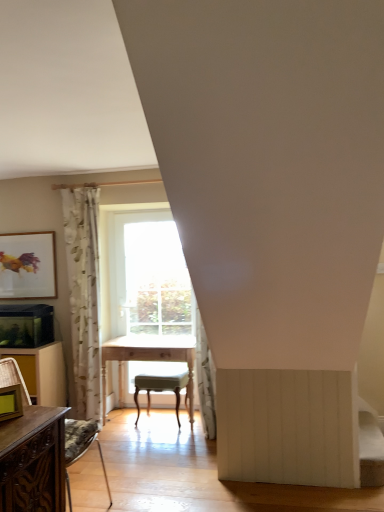
Question: From a real-world perspective, is brown wood dresser at lower left positioned over matte gold picture frame at lower left, placed as the second picture frame when sorted from back to front, based on gravity?

Choices:
 (A) no
 (B) yes

Answer: (A)

Question: Is brown wood dresser at lower left facing towards matte gold picture frame at lower left, which is counted as the second picture frame, starting from the left?

Choices:
 (A) no
 (B) yes

Answer: (A)

Question: Can you confirm if brown wood dresser at lower left is positioned to the left of matte gold picture frame at lower left, which is counted as the 1th picture frame, starting from the bottom?

Choices:
 (A) yes
 (B) no

Answer: (A)

Question: Can you confirm if brown wood dresser at lower left is smaller than matte gold picture frame at lower left, which is counted as the 1th picture frame, starting from the bottom?

Choices:
 (A) yes
 (B) no

Answer: (B)

Question: Considering the relative positions of brown wood dresser at lower left and matte gold picture frame at lower left, marked as the 1th picture frame in a front-to-back arrangement, in the image provided, is brown wood dresser at lower left in front of matte gold picture frame at lower left, marked as the 1th picture frame in a front-to-back arrangement,?

Choices:
 (A) yes
 (B) no

Answer: (B)

Question: Is matte gold picture frame at left, the 2th picture frame when ordered from bottom to top, wider or thinner than brown wood dresser at lower left?

Choices:
 (A) wide
 (B) thin

Answer: (B)

Question: Is matte gold picture frame at left, marked as the first picture frame in a top-to-bottom arrangement, spatially inside brown wood dresser at lower left, or outside of it?

Choices:
 (A) inside
 (B) outside

Answer: (B)

Question: From their relative heights in the image, would you say matte gold picture frame at left, the 2th picture frame when ordered from bottom to top, is taller or shorter than brown wood dresser at lower left?

Choices:
 (A) tall
 (B) short

Answer: (B)

Question: Considering the positions of matte gold picture frame at left, marked as the first picture frame in a top-to-bottom arrangement, and brown wood dresser at lower left in the image, is matte gold picture frame at left, marked as the first picture frame in a top-to-bottom arrangement, bigger or smaller than brown wood dresser at lower left?

Choices:
 (A) small
 (B) big

Answer: (A)

Question: Relative to brown wood dresser at lower left, is light wood table at center in front or behind?

Choices:
 (A) behind
 (B) front

Answer: (A)

Question: In the image, is light wood table at center on the left side or the right side of brown wood dresser at lower left?

Choices:
 (A) right
 (B) left

Answer: (A)

Question: Choose the correct answer: Is light wood table at center inside brown wood dresser at lower left or outside it?

Choices:
 (A) inside
 (B) outside

Answer: (B)

Question: Considering the positions of light wood table at center and brown wood dresser at lower left in the image, is light wood table at center wider or thinner than brown wood dresser at lower left?

Choices:
 (A) thin
 (B) wide

Answer: (B)

Question: From a real-world perspective, relative to light wood table at center, is white floral fabric curtain at left vertically above or below?

Choices:
 (A) below
 (B) above

Answer: (B)

Question: In the image, is white floral fabric curtain at left positioned in front of or behind light wood table at center?

Choices:
 (A) front
 (B) behind

Answer: (B)